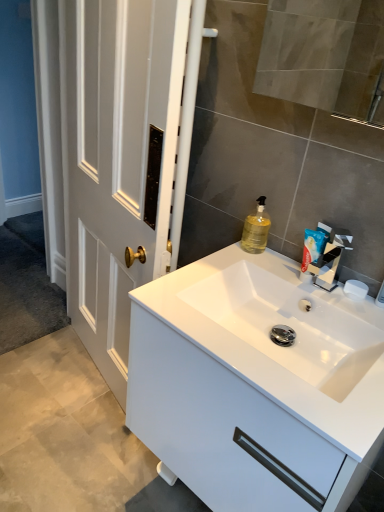
Identify the location of free location to the left of white plastic toothpaste tube at upper right. (244, 266).